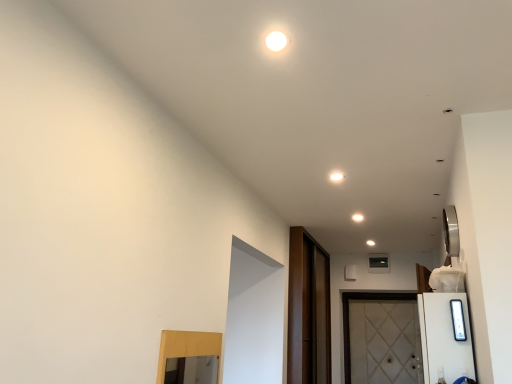
Question: From a real-world perspective, is white glossy light at upper center under white textured door at lower right?

Choices:
 (A) yes
 (B) no

Answer: (B)

Question: Is white glossy light at upper center not close to white textured door at lower right?

Choices:
 (A) yes
 (B) no

Answer: (A)

Question: Is white glossy light at upper center wider than white textured door at lower right?

Choices:
 (A) no
 (B) yes

Answer: (A)

Question: Is white glossy light at upper center positioned with its back to white textured door at lower right?

Choices:
 (A) yes
 (B) no

Answer: (B)

Question: Is the position of white glossy light at upper center more distant than that of white textured door at lower right?

Choices:
 (A) yes
 (B) no

Answer: (B)

Question: From the image's perspective, is white glossy light at upper center located beneath white textured door at lower right?

Choices:
 (A) yes
 (B) no

Answer: (B)

Question: Is white textured door at lower right bigger than dark brown wood screen door at center?

Choices:
 (A) yes
 (B) no

Answer: (B)

Question: From the image's perspective, is white textured door at lower right on top of dark brown wood screen door at center?

Choices:
 (A) no
 (B) yes

Answer: (A)

Question: Is white textured door at lower right directly adjacent to dark brown wood screen door at center?

Choices:
 (A) yes
 (B) no

Answer: (B)

Question: Is white textured door at lower right aimed at dark brown wood screen door at center?

Choices:
 (A) yes
 (B) no

Answer: (A)

Question: Is white textured door at lower right to the right of dark brown wood screen door at center from the viewer's perspective?

Choices:
 (A) yes
 (B) no

Answer: (A)

Question: Is white textured door at lower right not within dark brown wood screen door at center?

Choices:
 (A) no
 (B) yes

Answer: (B)

Question: Is white textured door at lower right to the right of white glossy light at upper center from the viewer's perspective?

Choices:
 (A) yes
 (B) no

Answer: (A)